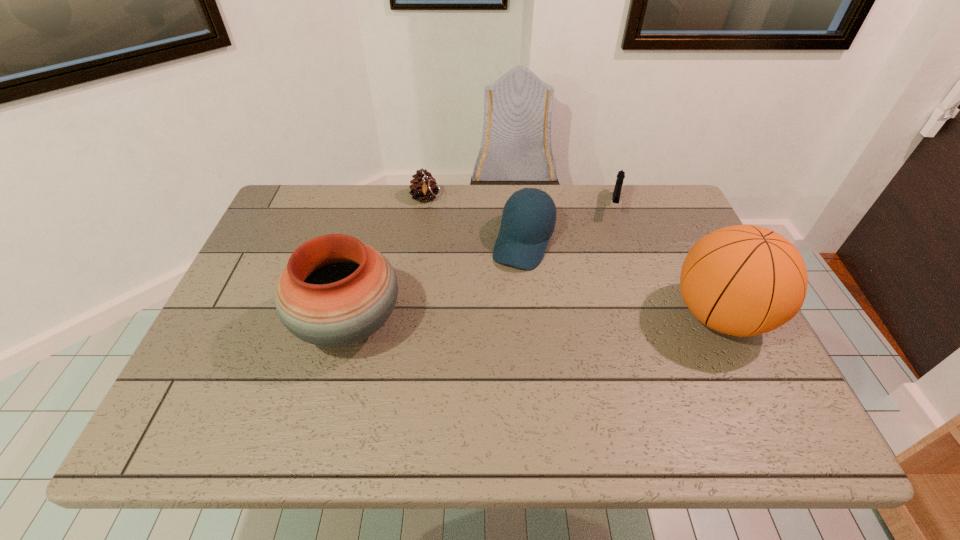
Find the location of `free space on the desktop that is between the pottery and the basketball and is positioned on the front-facing side of the third shortest object`. free space on the desktop that is between the pottery and the basketball and is positioned on the front-facing side of the third shortest object is located at coordinates (490, 321).

Where is `vacant space on the desktop that is between the pottery and the rightmost object and is positioned with a leaf charm attached to the pinecone`? This screenshot has height=540, width=960. vacant space on the desktop that is between the pottery and the rightmost object and is positioned with a leaf charm attached to the pinecone is located at coordinates (481, 321).

Locate an element on the screen. The height and width of the screenshot is (540, 960). vacant spot on the desktop that is between the pottery and the rightmost object and is positioned on the front-facing side of the pistol is located at coordinates (x=591, y=319).